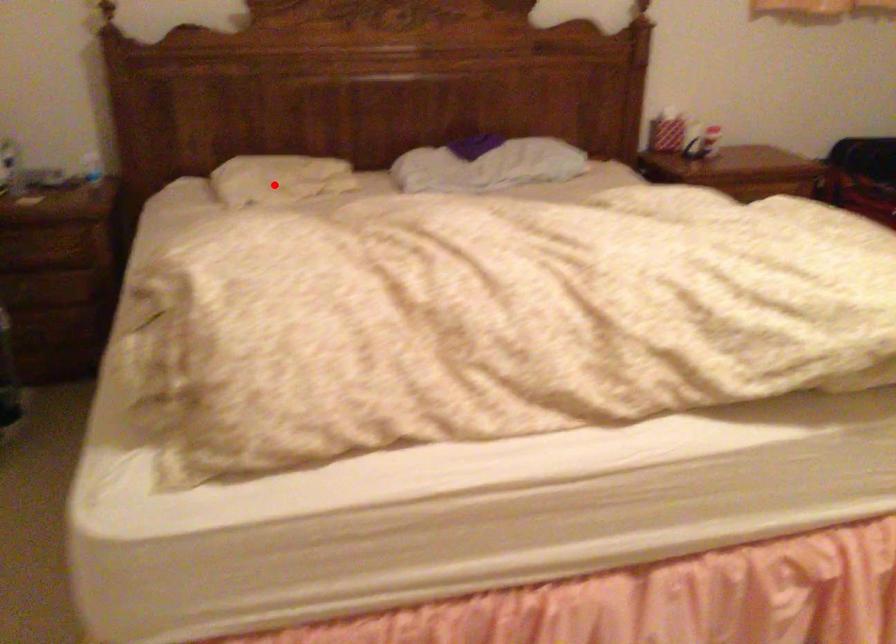
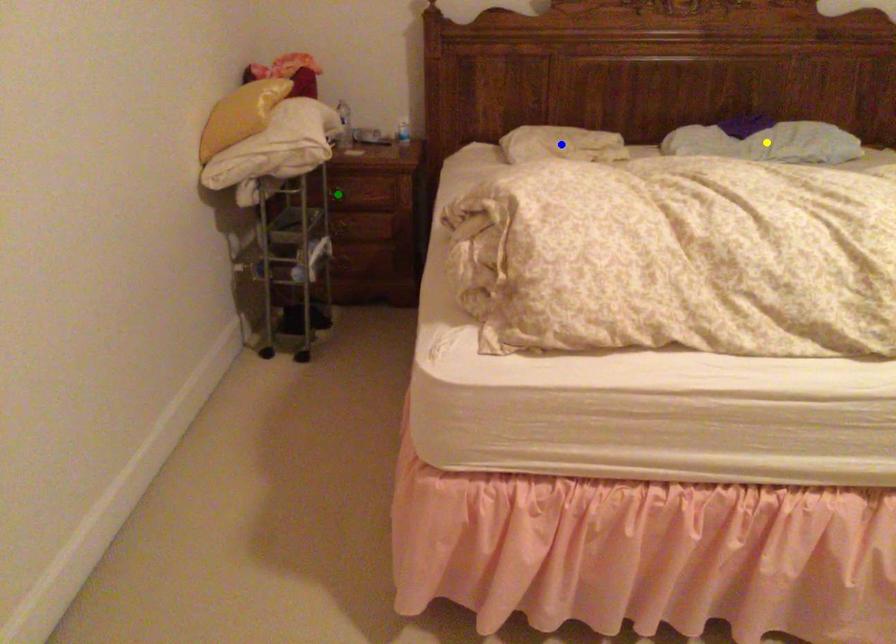
Question: I am providing you with two images of the same scene from different viewpoints. A red point is marked on the first image. You are given multiple points on the second image. In image 2, which mark is for the same physical point as the one in image 1?

Choices:
 (A) green point
 (B) blue point
 (C) yellow point

Answer: (B)